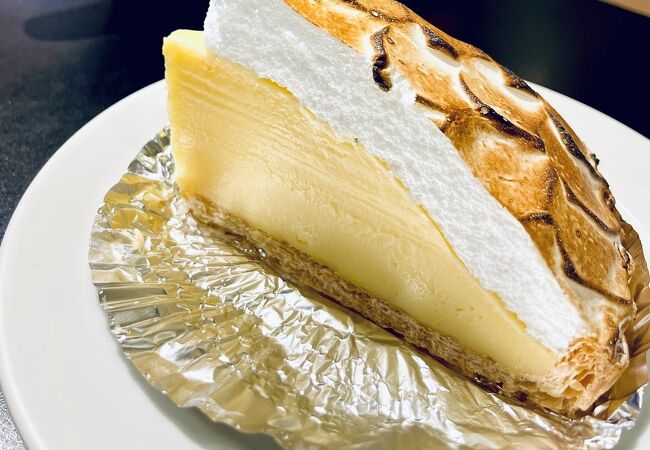
In order to click on table in this screenshot , I will do `click(75, 74)`.